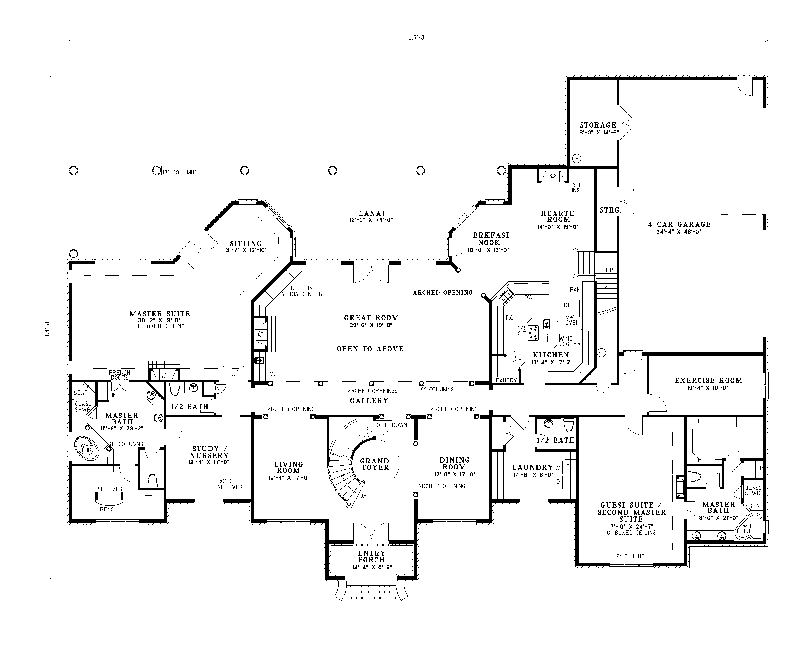
The height and width of the screenshot is (671, 800). I want to click on half bath, so click(x=166, y=382), click(x=214, y=380), click(x=212, y=413), click(x=164, y=415), click(x=537, y=419), click(x=574, y=415), click(x=572, y=444), click(x=537, y=444).